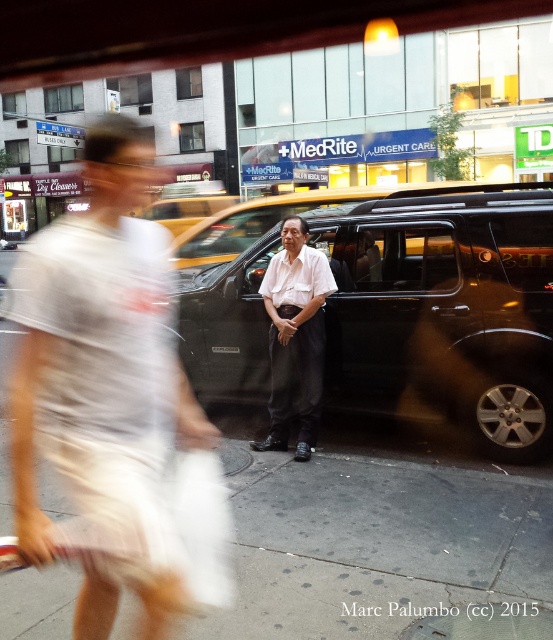
You are a delivery person trying to walk along the gray concrete sidewalk at center while avoiding the yellow metallic taxi at center. Can you pass through the area between them?

The gray concrete sidewalk at center has a smaller size compared to the yellow metallic taxi at center, so it is likely too narrow to pass safely between them. Choose another route.

Where is the white smooth shirt at center located in the image?

The white smooth shirt at center is located at point coordinates of 0.528 in the x axis and 0.535 in the y axis.